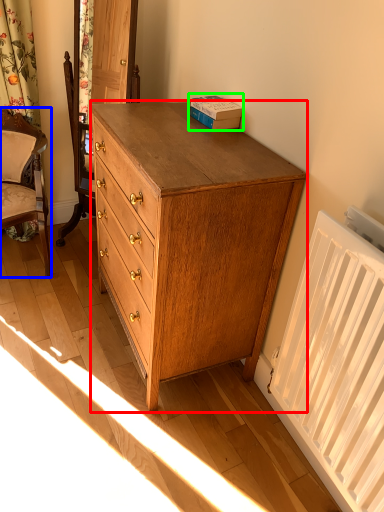
Question: Which is nearer to the chest of drawers (highlighted by a red box)? chair (highlighted by a blue box) or book (highlighted by a green box).

Choices:
 (A) chair
 (B) book

Answer: (B)